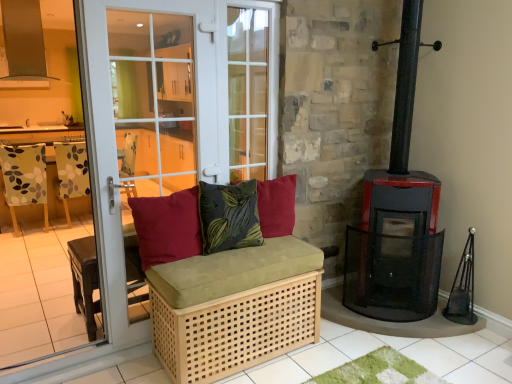
Where is `light brown woven bench at center`? light brown woven bench at center is located at coordinates (85, 280).

Measure the distance between point (269, 164) and camera.

They are 9.70 feet apart.

What is the approximate height of patterned fabric armchair at left?

The height of patterned fabric armchair at left is 37.85 inches.

Describe the element at coordinates (71, 173) in the screenshot. Image resolution: width=512 pixels, height=384 pixels. I see `patterned fabric armchair at left` at that location.

What do you see at coordinates (236, 329) in the screenshot? I see `natural wood woven basket at lower center` at bounding box center [236, 329].

What is the approximate width of natural wood woven basket at lower center?

The width of natural wood woven basket at lower center is 19.64 inches.

Where is `light brown woven bench at center`? light brown woven bench at center is located at coordinates (85, 280).

From the image's perspective, is matte red cushion at center, which appears as the 3th pillow when viewed from the right, located beneath velvet red cushion at center, which appears as the first pillow when viewed from the right?

Indeed, from the image's perspective, matte red cushion at center, which appears as the 3th pillow when viewed from the right, is shown beneath velvet red cushion at center, which appears as the first pillow when viewed from the right.

Can you confirm if matte red cushion at center, which appears as the 3th pillow when viewed from the right, is bigger than velvet red cushion at center, the third pillow from the left?

Correct, matte red cushion at center, which appears as the 3th pillow when viewed from the right, is larger in size than velvet red cushion at center, the third pillow from the left.

Between matte red cushion at center, marked as the 1th pillow in a left-to-right arrangement, and velvet red cushion at center, the third pillow from the left, which one is positioned behind?

Positioned behind is velvet red cushion at center, the third pillow from the left.

Consider the image. How much distance is there between matte red cushion at center, which appears as the 3th pillow when viewed from the right, and velvet red cushion at center, which appears as the first pillow when viewed from the right?

A distance of 23.38 inches exists between matte red cushion at center, which appears as the 3th pillow when viewed from the right, and velvet red cushion at center, which appears as the first pillow when viewed from the right.

From the image's perspective, is patterned fabric armchair at left located above or below velvet green pillow at center, which is the 2th pillow from left to right?

Clearly, from the image's perspective, patterned fabric armchair at left is above velvet green pillow at center, which is the 2th pillow from left to right.

Is patterned fabric armchair at left not close to velvet green pillow at center, the 2th pillow positioned from the right?

Yes, patterned fabric armchair at left is far from velvet green pillow at center, the 2th pillow positioned from the right.

Is patterned fabric armchair at left wider than velvet green pillow at center, the 2th pillow positioned from the right?

Yes.

Is black metal wood burning stove at right spatially inside velvet green pillow at center, which is the 2th pillow from left to right, or outside of it?

black metal wood burning stove at right is not enclosed by velvet green pillow at center, which is the 2th pillow from left to right.

From the image's perspective, is black metal wood burning stove at right beneath velvet green pillow at center, which is the 2th pillow from left to right?

Indeed, from the image's perspective, black metal wood burning stove at right is shown beneath velvet green pillow at center, which is the 2th pillow from left to right.

Based on the photo, from a real-world perspective, which is physically below, black metal wood burning stove at right or velvet green pillow at center, the 2th pillow positioned from the right?

From a 3D spatial view, black metal wood burning stove at right is below.

Does black metal wood burning stove at right have a larger size compared to velvet green pillow at center, which is the 2th pillow from left to right?

Yes.

How different are the orientations of velvet green pillow at center, the 2th pillow positioned from the right, and white glass door at left in degrees?

There is a 0.184-degree angle between the facing directions of velvet green pillow at center, the 2th pillow positioned from the right, and white glass door at left.

From the image's perspective, is velvet green pillow at center, which is the 2th pillow from left to right, above or below white glass door at left?

velvet green pillow at center, which is the 2th pillow from left to right, is below white glass door at left.

Is velvet green pillow at center, the 2th pillow positioned from the right, to the left of white glass door at left from the viewer's perspective?

In fact, velvet green pillow at center, the 2th pillow positioned from the right, is to the right of white glass door at left.

Is point (179, 351) less distant than point (260, 188)?

That is True.

In the scene shown: Could you tell me if natural wood woven basket at lower center is facing velvet red cushion at center, which appears as the first pillow when viewed from the right?

No, natural wood woven basket at lower center does not turn towards velvet red cushion at center, which appears as the first pillow when viewed from the right.

Considering the relative sizes of natural wood woven basket at lower center and velvet red cushion at center, the third pillow from the left, in the image provided, is natural wood woven basket at lower center thinner than velvet red cushion at center, the third pillow from the left,?

In fact, natural wood woven basket at lower center might be wider than velvet red cushion at center, the third pillow from the left.

Could velvet red cushion at center, the third pillow from the left, be considered to be inside natural wood woven basket at lower center?

Definitely not — velvet red cushion at center, the third pillow from the left, is not inside natural wood woven basket at lower center.

Is natural wood woven basket at lower center at the back of light brown woven bench at center?

No, light brown woven bench at center is not facing away from natural wood woven basket at lower center.

Is light brown woven bench at center taller than natural wood woven basket at lower center?

In fact, light brown woven bench at center may be shorter than natural wood woven basket at lower center.

Is light brown woven bench at center not close to natural wood woven basket at lower center?

No, light brown woven bench at center is in close proximity to natural wood woven basket at lower center.

Consider the image. Is light brown woven bench at center at the left side of natural wood woven basket at lower center?

Result: Indeed, light brown woven bench at center is positioned on the left side of natural wood woven basket at lower center.

Considering the relative sizes of white glass door at left and light brown woven bench at center in the image provided, is white glass door at left thinner than light brown woven bench at center?

Correct, the width of white glass door at left is less than that of light brown woven bench at center.

Is point (154, 142) in front of point (131, 270)?

Yes, it is in front of point (131, 270).

Which object is further away from the camera, white glass door at left or light brown woven bench at center?

Positioned behind is light brown woven bench at center.

Considering the sizes of objects white glass door at left and light brown woven bench at center in the image provided, who is smaller, white glass door at left or light brown woven bench at center?

light brown woven bench at center.

From the image's perspective, which pillow is the 2nd one below the velvet red cushion at center, the third pillow from the left? Please provide its 2D coordinates.

[(167, 227)]

This screenshot has height=384, width=512. In order to click on armchair lying above the velvet green pillow at center, which is the 2th pillow from left to right (from the image's perspective) in this screenshot , I will do `click(71, 173)`.

From the picture: Estimate the real-world distances between objects in this image. Which object is closer to velvet red cushion at center, which appears as the first pillow when viewed from the right, velvet green pillow at center, the 2th pillow positioned from the right, or floral fabric chair at left?

velvet green pillow at center, the 2th pillow positioned from the right, lies closer to velvet red cushion at center, which appears as the first pillow when viewed from the right, than the other object.

Based on the photo, from the image, which object appears to be farther from velvet red cushion at center, the third pillow from the left, white glass door at left or matte red cushion at center, marked as the 1th pillow in a left-to-right arrangement?

Among the two, white glass door at left is located further to velvet red cushion at center, the third pillow from the left.

Which object lies further to the anchor point natural wood woven basket at lower center, velvet red cushion at center, the third pillow from the left, or matte red cushion at center, marked as the 1th pillow in a left-to-right arrangement?

velvet red cushion at center, the third pillow from the left, is positioned further to the anchor natural wood woven basket at lower center.

Estimate the real-world distances between objects in this image. Which object is further from black metal wood burning stove at right, velvet red cushion at center, which appears as the first pillow when viewed from the right, or velvet green pillow at center, the 2th pillow positioned from the right?

Among the two, velvet green pillow at center, the 2th pillow positioned from the right, is located further to black metal wood burning stove at right.

Based on their spatial positions, is natural wood woven basket at lower center or light brown woven bench at center further from black metal wood burning stove at right?

light brown woven bench at center lies further to black metal wood burning stove at right than the other object.

From the image, which object appears to be nearer to floral fabric chair at left, light brown woven bench at center or natural wood woven basket at lower center?

The object closer to floral fabric chair at left is light brown woven bench at center.

Based on their spatial positions, is velvet green pillow at center, which is the 2th pillow from left to right, or black metal wood burning stove at right further from matte red cushion at center, marked as the 1th pillow in a left-to-right arrangement?

Among the two, black metal wood burning stove at right is located further to matte red cushion at center, marked as the 1th pillow in a left-to-right arrangement.

When comparing their distances from matte red cushion at center, which appears as the 3th pillow when viewed from the right, does black metal wood burning stove at right or velvet red cushion at center, which appears as the first pillow when viewed from the right, seem further?

black metal wood burning stove at right.

Identify the location of furniture positioned between natural wood woven basket at lower center and patterned fabric armchair at left from near to far. Image resolution: width=512 pixels, height=384 pixels. (85, 280).

This screenshot has width=512, height=384. Identify the location of furniture between white glass door at left and natural wood woven basket at lower center from top to bottom. (85, 280).

The image size is (512, 384). What are the coordinates of `crate between light brown woven bench at center and black metal wood burning stove at right from left to right` in the screenshot? It's located at (236, 329).

Locate an element on the screen. The width and height of the screenshot is (512, 384). crate located between white glass door at left and black metal wood burning stove at right in the left-right direction is located at coordinates (236, 329).